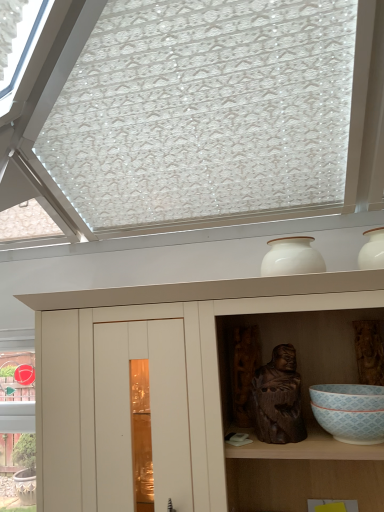
Question: Is dark brown wood statue at center at the right side of white glossy bowl at lower right?

Choices:
 (A) no
 (B) yes

Answer: (A)

Question: From the image's perspective, is dark brown wood statue at center beneath white glossy bowl at lower right?

Choices:
 (A) yes
 (B) no

Answer: (B)

Question: Considering the relative sizes of dark brown wood statue at center and white glossy bowl at lower right in the image provided, is dark brown wood statue at center smaller than white glossy bowl at lower right?

Choices:
 (A) yes
 (B) no

Answer: (B)

Question: Is dark brown wood statue at center positioned beyond the bounds of white glossy bowl at lower right?

Choices:
 (A) no
 (B) yes

Answer: (B)

Question: Is dark brown wood statue at center looking in the opposite direction of white glossy bowl at lower right?

Choices:
 (A) yes
 (B) no

Answer: (B)

Question: Does dark brown wood statue at center have a lesser height compared to white glossy bowl at lower right?

Choices:
 (A) yes
 (B) no

Answer: (B)

Question: From the image's perspective, is white glossy bowl at lower right under dark brown wood statue at center?

Choices:
 (A) no
 (B) yes

Answer: (B)

Question: From the image's perspective, is white glossy bowl at lower right over dark brown wood statue at center?

Choices:
 (A) no
 (B) yes

Answer: (A)

Question: Is white glossy bowl at lower right turned away from dark brown wood statue at center?

Choices:
 (A) yes
 (B) no

Answer: (B)

Question: From a real-world perspective, is white glossy bowl at lower right on top of dark brown wood statue at center?

Choices:
 (A) yes
 (B) no

Answer: (B)

Question: Considering the relative positions of white glossy bowl at lower right and dark brown wood statue at center in the image provided, is white glossy bowl at lower right to the right of dark brown wood statue at center from the viewer's perspective?

Choices:
 (A) no
 (B) yes

Answer: (B)

Question: Does white glossy bowl at lower right touch dark brown wood statue at center?

Choices:
 (A) yes
 (B) no

Answer: (B)

Question: From a real-world perspective, is white matte cupboard at upper center under white glossy vase at upper center?

Choices:
 (A) no
 (B) yes

Answer: (B)